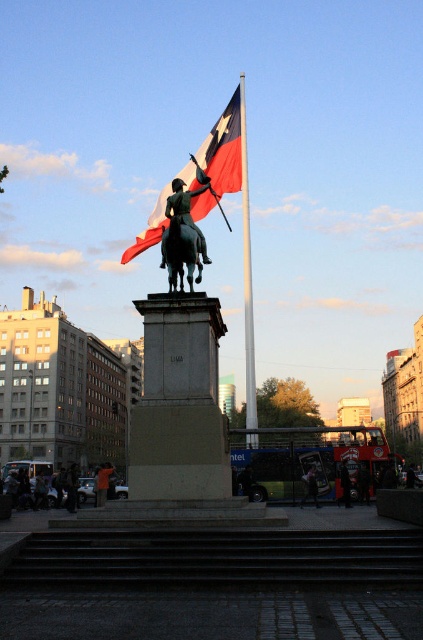
Looking at this image, you are standing at point A, which is at coordinates point (x=175, y=266), and you want to walk to point B at coordinates point (x=76, y=481). According to the image, will you need to walk around the statue to reach your destination?

Point (x=175, y=266) is in front of point (x=76, y=481), so you will not need to walk around the statue to reach your destination.

You are standing at the point marked by point (109, 467) and want to take a photo of the statue. Will the statue be visible in your photo if you face towards point (238, 129)?

Point (238, 129) is behind point (109, 467), so if you are facing towards point (238, 129) from point (109, 467), the statue will be visible in your photo because the statue is located at the square where the points are situated.